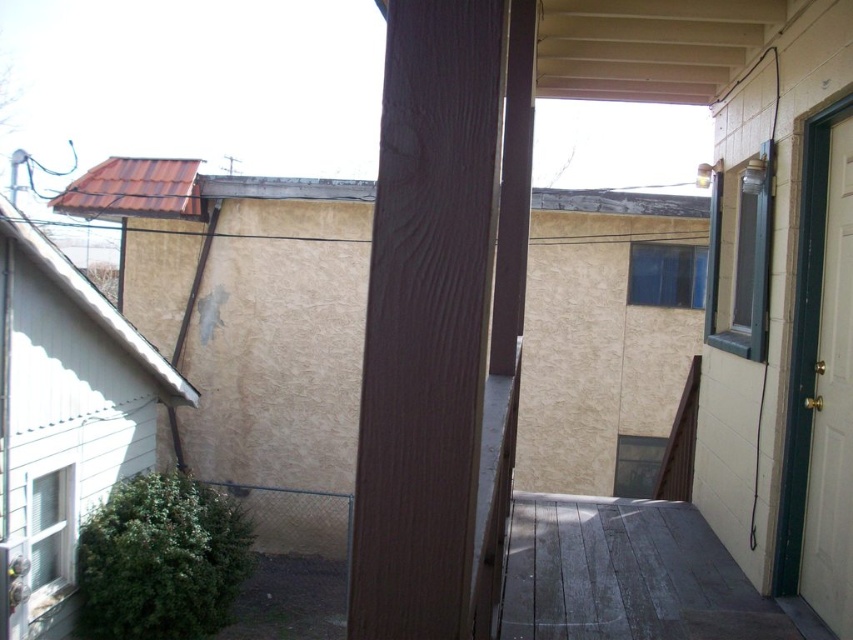
Is weathered wood deck at lower center closer to camera compared to white glossy door at right?

No, weathered wood deck at lower center is further to the viewer.

Is weathered wood deck at lower center taller than white glossy door at right?

No, weathered wood deck at lower center is not taller than white glossy door at right.

Identify the location of weathered wood deck at lower center. The image size is (853, 640). (625, 573).